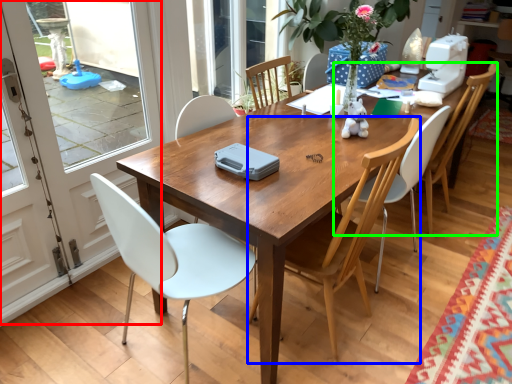
Question: Considering the real-world distances, which object is closest to screen door (highlighted by a red box)? chair (highlighted by a blue box) or chair (highlighted by a green box).

Choices:
 (A) chair
 (B) chair

Answer: (A)